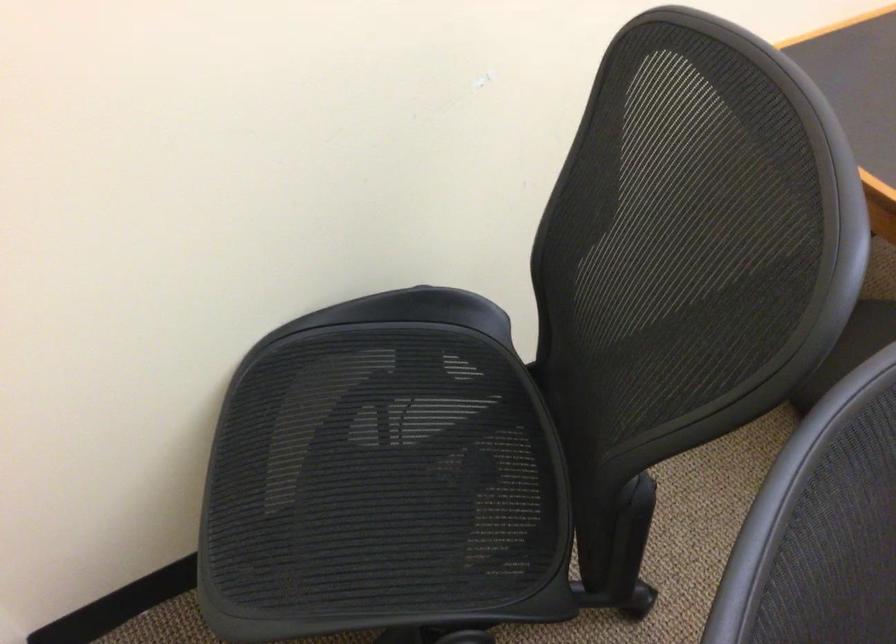
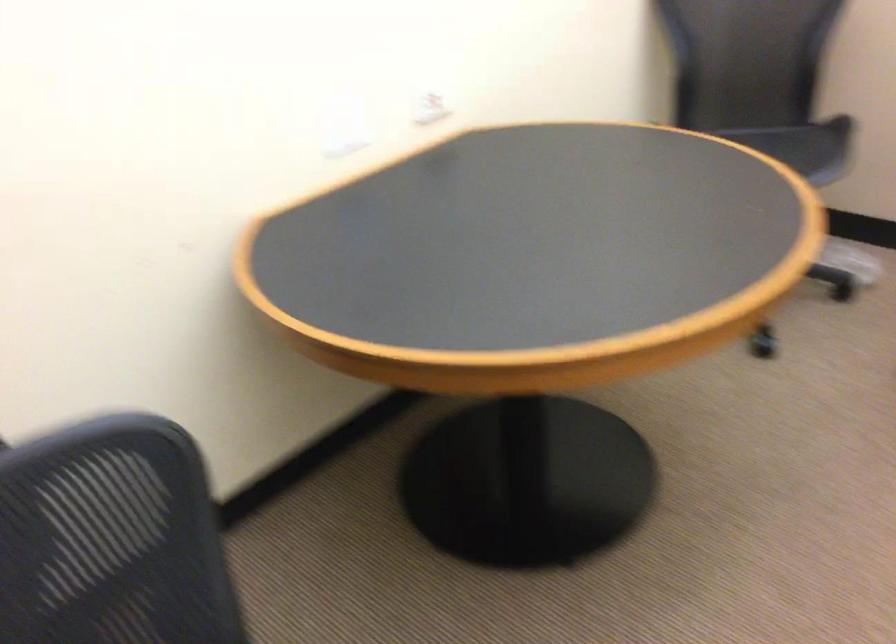
Question: The first image is from the beginning of the video and the second image is from the end. How did the camera likely rotate when shooting the video?

Choices:
 (A) Left
 (B) Right
 (C) Up
 (D) Down

Answer: (C)